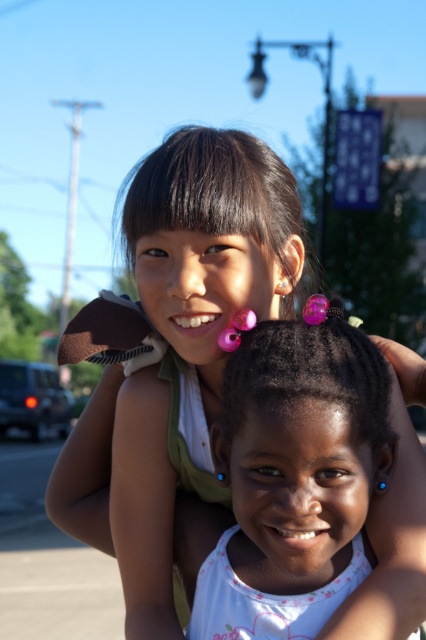
Between pink hair clips at center and black shiny hair at upper center, which one is positioned higher?

black shiny hair at upper center

Looking at this image, is pink hair clips at center smaller than black shiny hair at upper center?

Yes, pink hair clips at center is smaller than black shiny hair at upper center.

Is point (293, 422) closer to viewer compared to point (198, 125)?

Yes, point (293, 422) is closer to viewer.

At what (x,y) coordinates should I click in order to perform the action: click on pink hair clips at center. Please return your answer as a coordinate pair (x, y). The image size is (426, 640). Looking at the image, I should click on pos(293,480).

Between black shiny hair at upper center and purple glossy hair at center, which one is positioned higher?

black shiny hair at upper center is above.

Does point (131, 262) come in front of point (367, 340)?

No.

The width and height of the screenshot is (426, 640). I want to click on black shiny hair at upper center, so click(218, 196).

Identify the location of black shiny hair at upper center. (218, 196).

Is matte green shirt at upper center closer to the viewer compared to pink hair clips at center?

No.

Which is above, matte green shirt at upper center or pink hair clips at center?

Positioned higher is matte green shirt at upper center.

Who is more distant from viewer, (209, 404) or (339, 547)?

Positioned behind is point (209, 404).

Locate an element on the screen. The height and width of the screenshot is (640, 426). matte green shirt at upper center is located at coordinates (180, 355).